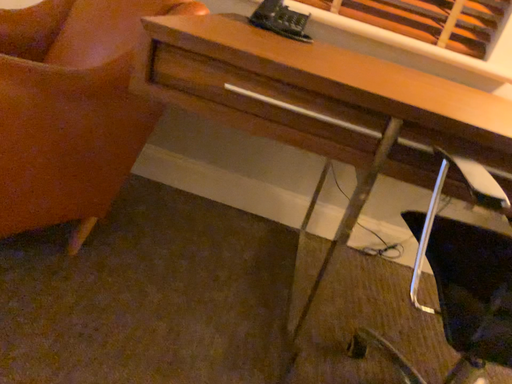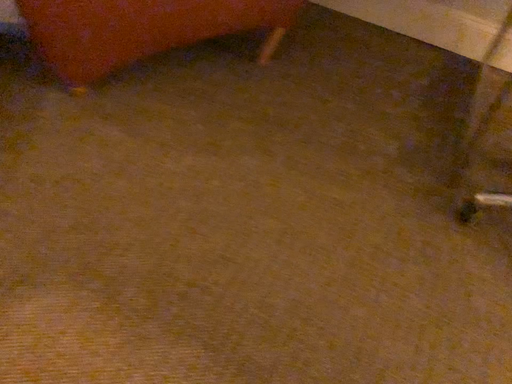
Question: Which way did the camera rotate in the video?

Choices:
 (A) rotated upward
 (B) rotated downward

Answer: (B)